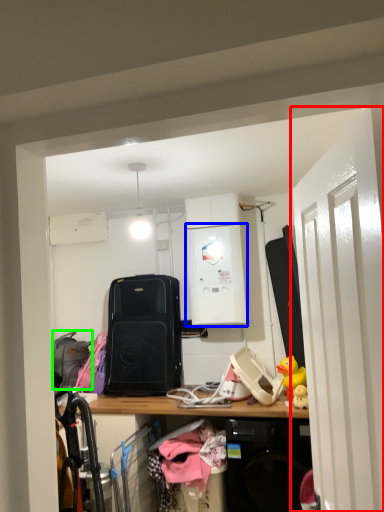
Question: Estimate the real-world distances between objects in this image. Which object is farther from door (highlighted by a red box), appliance (highlighted by a blue box) or luggage (highlighted by a green box)?

Choices:
 (A) appliance
 (B) luggage

Answer: (B)